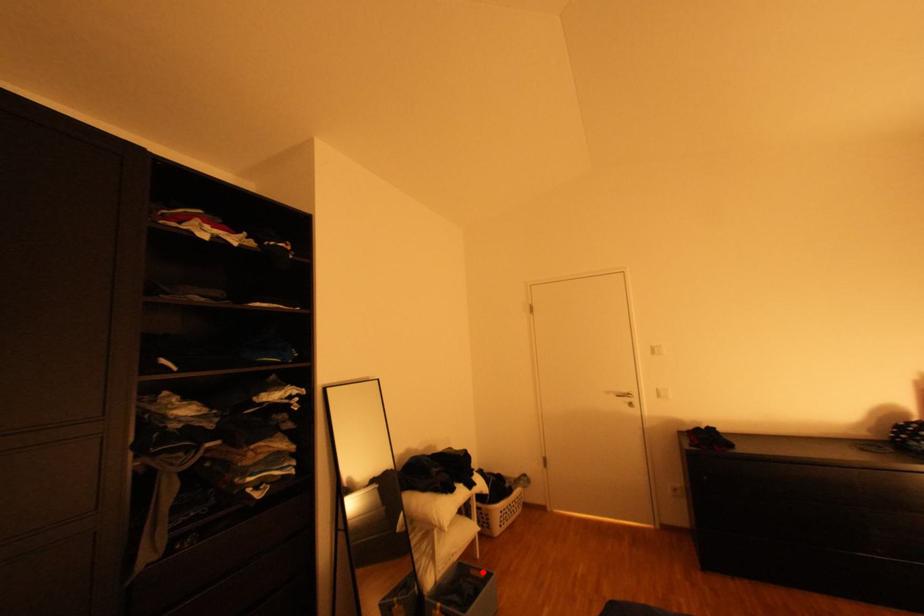
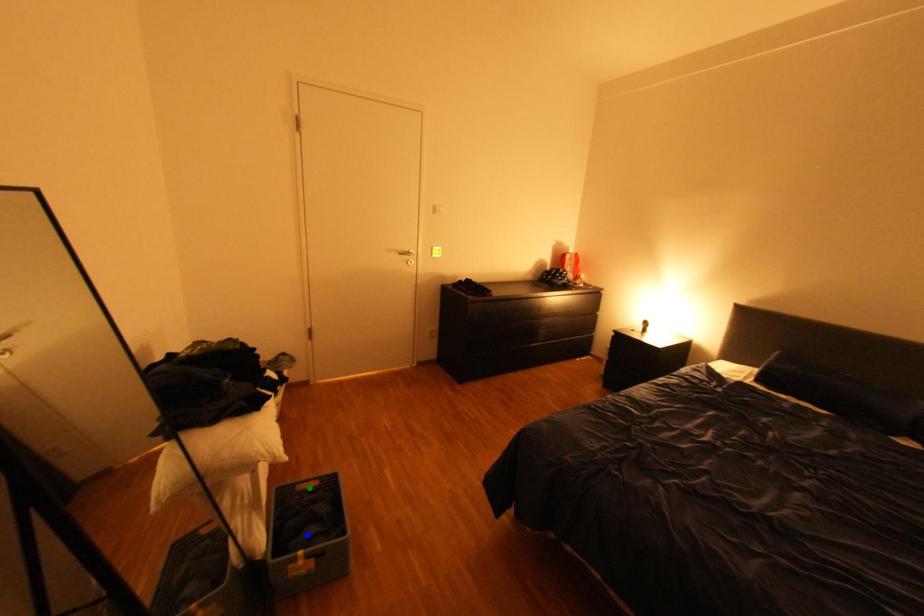
Question: I am providing you with two images of the same scene from different viewpoints. A red point is marked on the first image. You are given multiple points on the second image. Can you choose the point in image 2 that corresponds to the point in image 1?

Choices:
 (A) yellow point
 (B) blue point
 (C) green point

Answer: (C)